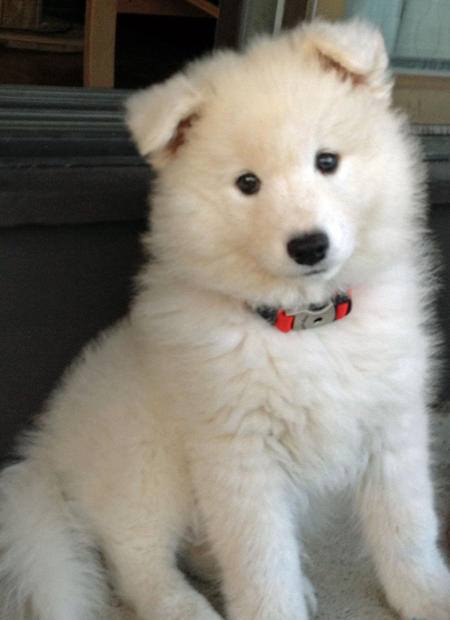
At what (x,y) coordinates should I click in order to perform the action: click on floor. Please return your answer as a coordinate pair (x, y). Looking at the image, I should click on (339, 564).